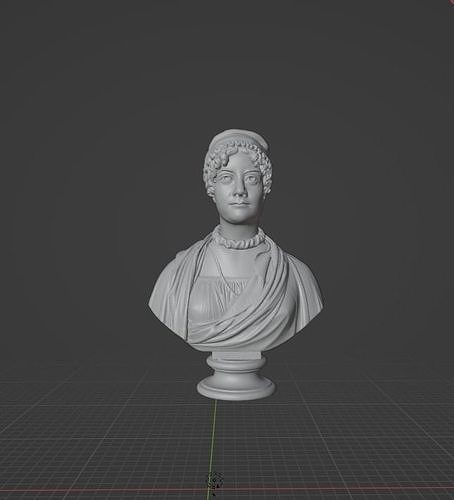
Find the location of `chest`. chest is located at coordinates (216, 295).